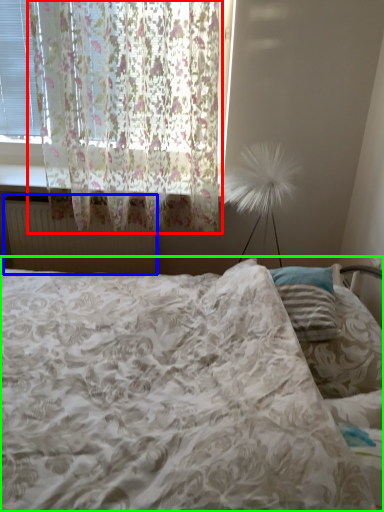
Question: Which object is the farthest from curtain (highlighted by a red box)? Choose among these: radiator (highlighted by a blue box) or bed (highlighted by a green box).

Choices:
 (A) radiator
 (B) bed

Answer: (B)